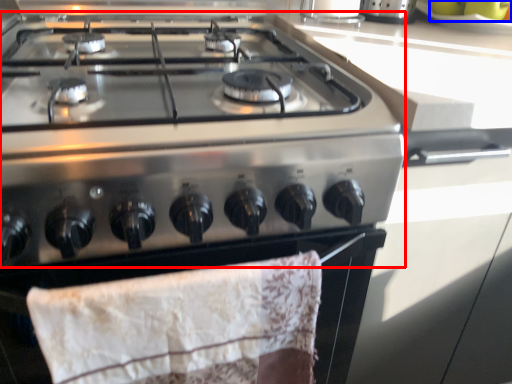
Question: Which of the following is the closest to the observer, gas stove (highlighted by a red box) or fruit (highlighted by a blue box)?

Choices:
 (A) gas stove
 (B) fruit

Answer: (A)